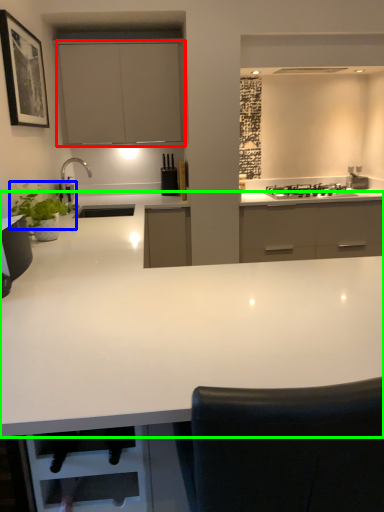
Question: Based on their relative distances, which object is farther from cabinetry (highlighted by a red box)? Choose from plant (highlighted by a blue box) and countertop (highlighted by a green box).

Choices:
 (A) plant
 (B) countertop

Answer: (B)